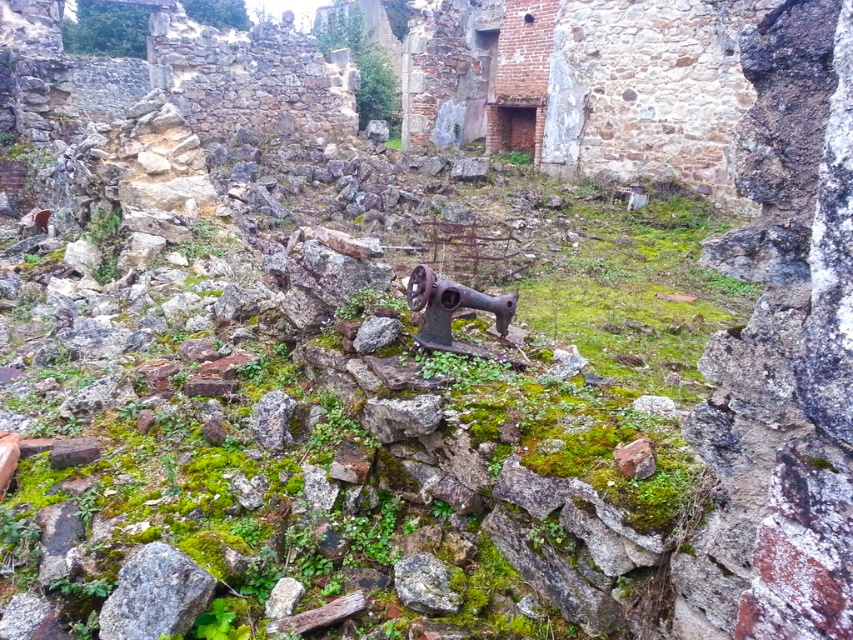
Who is positioned more to the right, rusty metal sewing machine at center or rusty metal stone at center?

From the viewer's perspective, rusty metal sewing machine at center appears more on the right side.

Consider the image. Does rusty metal sewing machine at center have a greater height compared to rusty metal stone at center?

Indeed, rusty metal sewing machine at center has a greater height compared to rusty metal stone at center.

Does point (415, 305) lie behind point (447, 580)?

Yes, it is.

Locate an element on the screen. rusty metal sewing machine at center is located at coordinates (451, 312).

Consider the image. Is gray rough stone at lower left to the right of rusty metal stone at center from the viewer's perspective?

No, gray rough stone at lower left is not to the right of rusty metal stone at center.

This screenshot has height=640, width=853. What do you see at coordinates (155, 595) in the screenshot?
I see `gray rough stone at lower left` at bounding box center [155, 595].

Identify the location of gray rough stone at lower left. (155, 595).

Does gray rough stone at lower left have a greater height compared to rusty metal sewing machine at center?

No.

How much distance is there between gray rough stone at lower left and rusty metal sewing machine at center?

gray rough stone at lower left is 1.38 meters from rusty metal sewing machine at center.

Does point (172, 564) come farther from viewer compared to point (442, 317)?

No, it is not.

Image resolution: width=853 pixels, height=640 pixels. In order to click on gray rough stone at lower left in this screenshot , I will do `click(155, 595)`.